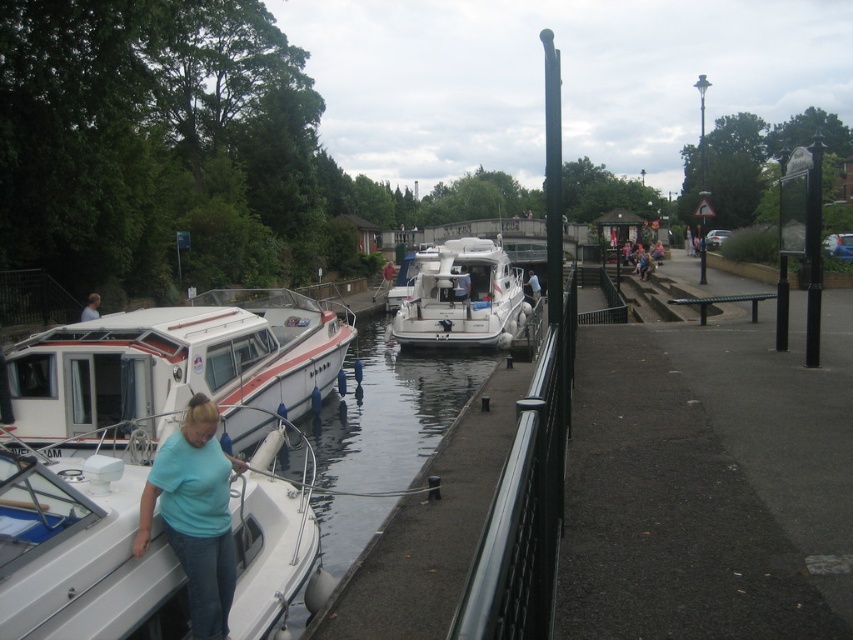
Is point (103, 444) farther from viewer compared to point (463, 340)?

No, (103, 444) is in front of (463, 340).

Is white glossy boat at left thinner than white glossy motorboat at center?

Incorrect, white glossy boat at left's width is not less than white glossy motorboat at center's.

In order to click on white glossy boat at left in this screenshot , I will do tap(173, 371).

Does white glossy boat at lower left have a greater width compared to light blue cotton shirt at lower left?

Correct, the width of white glossy boat at lower left exceeds that of light blue cotton shirt at lower left.

Who is more forward, (15, 579) or (210, 422)?

Positioned in front is point (15, 579).

Does point (270, 604) come behind point (218, 468)?

Yes.

Where is `white glossy boat at lower left`? This screenshot has width=853, height=640. white glossy boat at lower left is located at coordinates (82, 552).

Who is taller, white glossy boat at lower left or blue fabric shirt at center?

A: With more height is blue fabric shirt at center.

Is point (56, 568) behind point (538, 291)?

No, it is in front of (538, 291).

I want to click on white glossy boat at lower left, so click(82, 552).